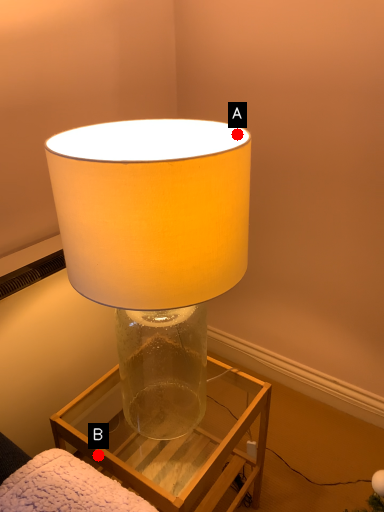
Question: Two points are circled on the image, labeled by A and B beside each circle. Which of the following is the farthest from the observer?

Choices:
 (A) A is further
 (B) B is further

Answer: (B)